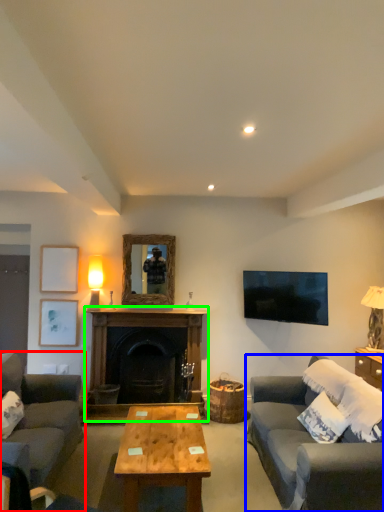
Question: Estimate the real-world distances between objects in this image. Which object is closer to studio couch (highlighted by a red box), studio couch (highlighted by a blue box) or fireplace (highlighted by a green box)?

Choices:
 (A) studio couch
 (B) fireplace

Answer: (B)